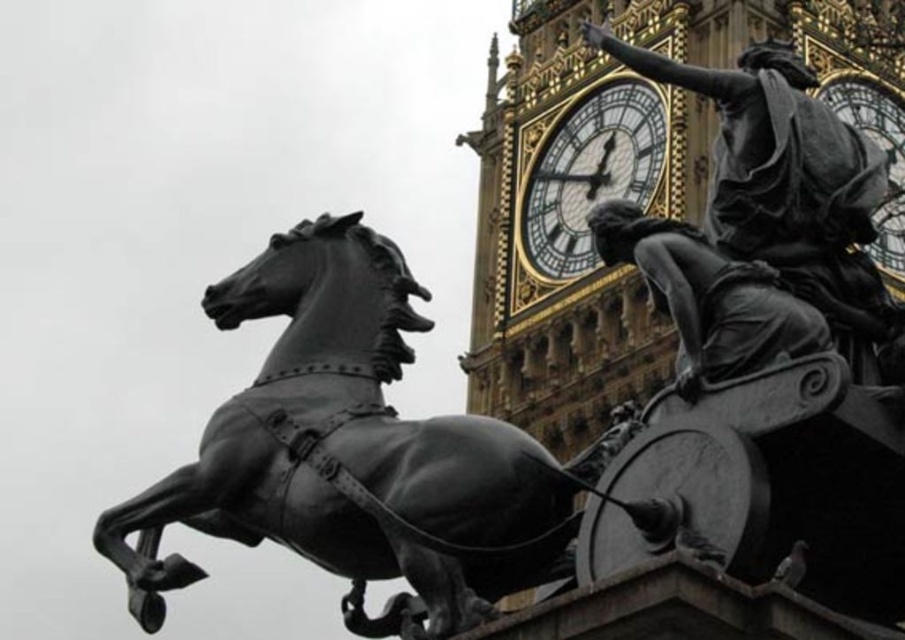
You are an architect designing a new public square and want to place a statue of a horse in the center. You have a blueprint showing coordinates where the statue should be placed. According to the image provided, what are the coordinates for placing the polished bronze horse at center?

The coordinates for placing the polished bronze horse at center are at point (x=349, y=449).